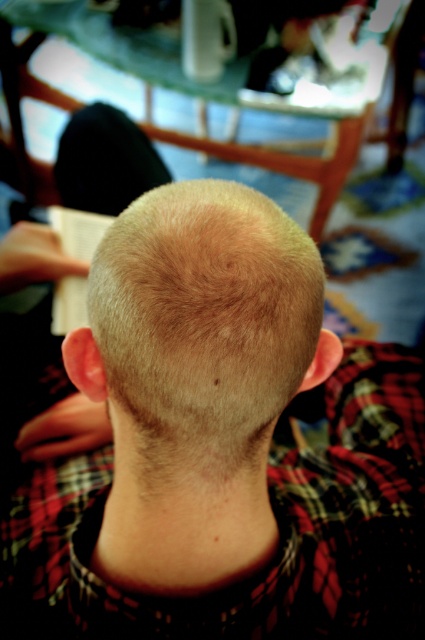
Between blonde hair at center and blonde smooth hair at center, which one is positioned lower?

blonde hair at center

Between blonde hair at center and blonde smooth hair at center, which one is positioned higher?

blonde smooth hair at center is higher up.

What do you see at coordinates (224, 444) in the screenshot? Image resolution: width=425 pixels, height=640 pixels. I see `blonde hair at center` at bounding box center [224, 444].

Where is `blonde hair at center`? The height and width of the screenshot is (640, 425). blonde hair at center is located at coordinates (224, 444).